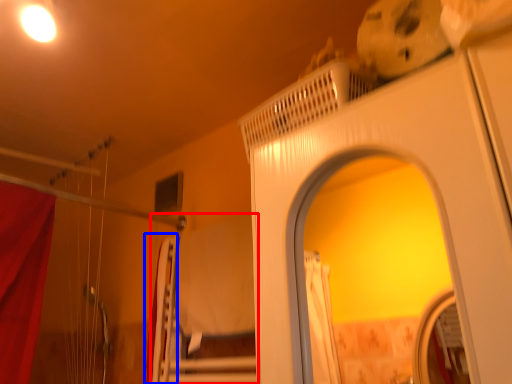
Question: Which object is closer to the camera taking this photo, bed (highlighted by a red box) or curtain (highlighted by a blue box)?

Choices:
 (A) bed
 (B) curtain

Answer: (A)